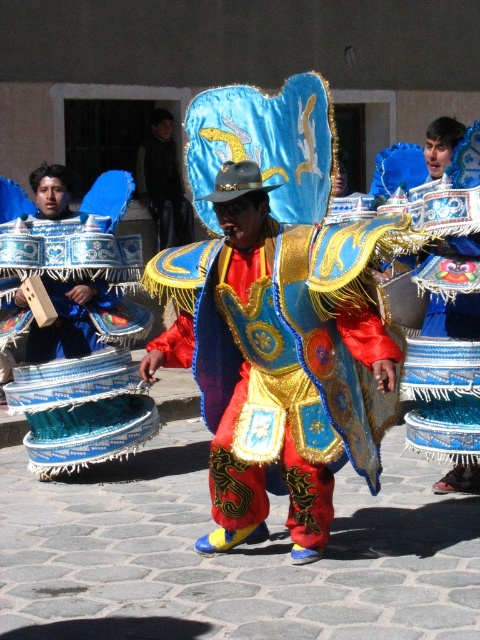
You are a photographer at the festival. You want to take a photo of the shiny metallic armor at center and the blue woven basket at left. Which object should you focus on first if you want to capture both in a single frame without moving the camera?

The shiny metallic armor at center is taller than the blue woven basket at left, so you should focus on the shiny metallic armor at center first to ensure both objects fit within the frame.

Please use the coordinate system where the bottom left corner is the origin. The shiny metallic armor at center is located at what coordinates?

The shiny metallic armor at center is located at coordinates approximately at point [280,362].